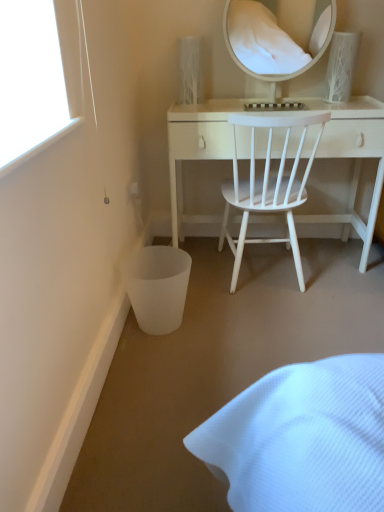
Question: Is white textured vase at upper right behind white matte wood desk at center?

Choices:
 (A) yes
 (B) no

Answer: (A)

Question: Considering the relative positions of white textured vase at upper right and white matte wood desk at center in the image provided, is white textured vase at upper right to the right of white matte wood desk at center from the viewer's perspective?

Choices:
 (A) yes
 (B) no

Answer: (A)

Question: Is white textured vase at upper right next to white matte wood desk at center?

Choices:
 (A) no
 (B) yes

Answer: (A)

Question: Does white textured vase at upper right have a larger size compared to white matte wood desk at center?

Choices:
 (A) yes
 (B) no

Answer: (B)

Question: Considering the relative sizes of white textured vase at upper right and white matte wood desk at center in the image provided, is white textured vase at upper right wider than white matte wood desk at center?

Choices:
 (A) no
 (B) yes

Answer: (A)

Question: Is white matte wood desk at center inside white textured vase at upper right?

Choices:
 (A) no
 (B) yes

Answer: (A)

Question: Is white wood chair at center bigger than white matte wood desk at center?

Choices:
 (A) no
 (B) yes

Answer: (A)

Question: Considering the relative positions of white wood chair at center and white matte wood desk at center in the image provided, is white wood chair at center to the left of white matte wood desk at center from the viewer's perspective?

Choices:
 (A) no
 (B) yes

Answer: (B)

Question: From a real-world perspective, is white wood chair at center located higher than white matte wood desk at center?

Choices:
 (A) yes
 (B) no

Answer: (A)

Question: Does white wood chair at center come behind white matte wood desk at center?

Choices:
 (A) no
 (B) yes

Answer: (A)

Question: Does white wood chair at center contain white matte wood desk at center?

Choices:
 (A) yes
 (B) no

Answer: (B)

Question: Does white wood chair at center have a smaller size compared to white matte wood desk at center?

Choices:
 (A) no
 (B) yes

Answer: (B)

Question: Can you confirm if white glossy mirror at upper center is smaller than white matte wood desk at center?

Choices:
 (A) yes
 (B) no

Answer: (A)